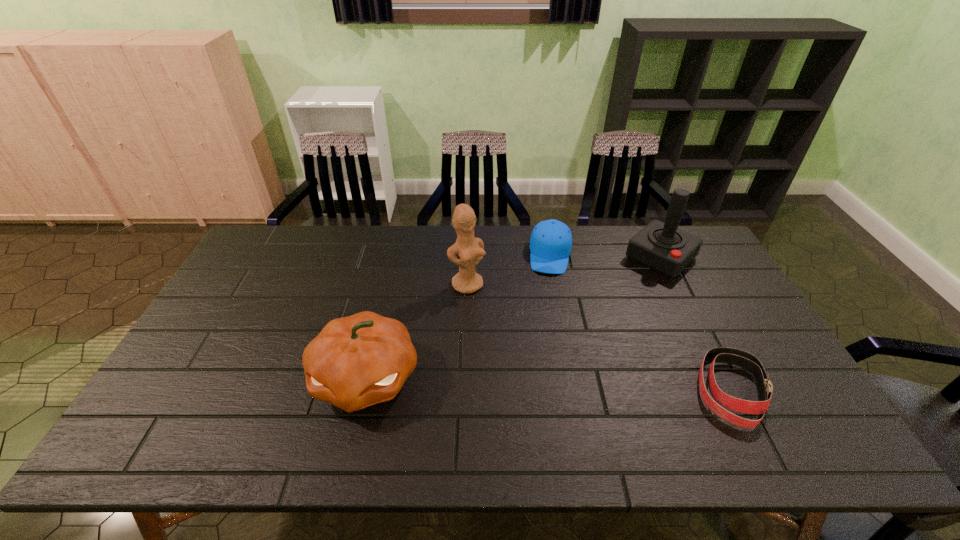
Find the location of a particular element. vacant space located on the front-facing side of the fourth object from right to left is located at coordinates (536, 371).

You are a GUI agent. You are given a task and a screenshot of the screen. Output one action in this format:
    pyautogui.click(x=<x>, y=<y>)
    Task: Click on the free region located on the front-facing side of the third object from left to right
    
    Given the screenshot: What is the action you would take?
    550,288

Image resolution: width=960 pixels, height=540 pixels. I want to click on vacant space situated on the front-facing side of the third object from left to right, so click(x=549, y=292).

This screenshot has width=960, height=540. What are the coordinates of `vacant space located 0.270m on the front-facing side of the third object from left to right` in the screenshot? It's located at (546, 337).

Locate an element on the screen. vacant space located 0.210m on the base of the joystick is located at coordinates (608, 307).

Where is `vacant space situated on the base of the joystick`? The width and height of the screenshot is (960, 540). vacant space situated on the base of the joystick is located at coordinates (586, 328).

Locate an element on the screen. The image size is (960, 540). free space located 0.180m on the base of the joystick is located at coordinates (613, 302).

The image size is (960, 540). Find the location of `cap that is at the far edge`. cap that is at the far edge is located at coordinates (551, 240).

Where is `joystick present at the far edge`? Image resolution: width=960 pixels, height=540 pixels. joystick present at the far edge is located at coordinates (662, 247).

At what (x,y) coordinates should I click in order to perform the action: click on pumpkin that is positioned at the near edge. Please return your answer as a coordinate pair (x, y). Looking at the image, I should click on (357, 361).